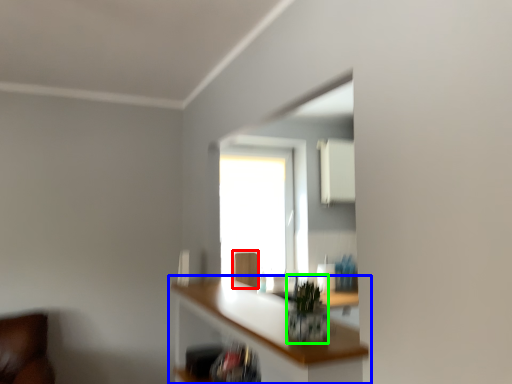
Question: Based on their relative distances, which object is nearer to swivel chair (highlighted by a red box)? Choose from shelf (highlighted by a blue box) and plant (highlighted by a green box).

Choices:
 (A) shelf
 (B) plant

Answer: (A)